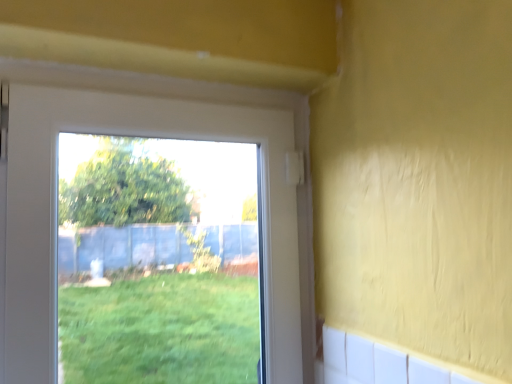
In order to face white plastic window at upper left, should I rotate leftwards or rightwards?

Rotate your view left by about 10.070°.

At what (x,y) coordinates should I click in order to perform the action: click on white plastic window at upper left. Please return your answer as a coordinate pair (x, y). The height and width of the screenshot is (384, 512). Looking at the image, I should click on (137, 135).

The height and width of the screenshot is (384, 512). What do you see at coordinates (137, 135) in the screenshot? I see `white plastic window at upper left` at bounding box center [137, 135].

Identify the location of white plastic window at upper left. (137, 135).